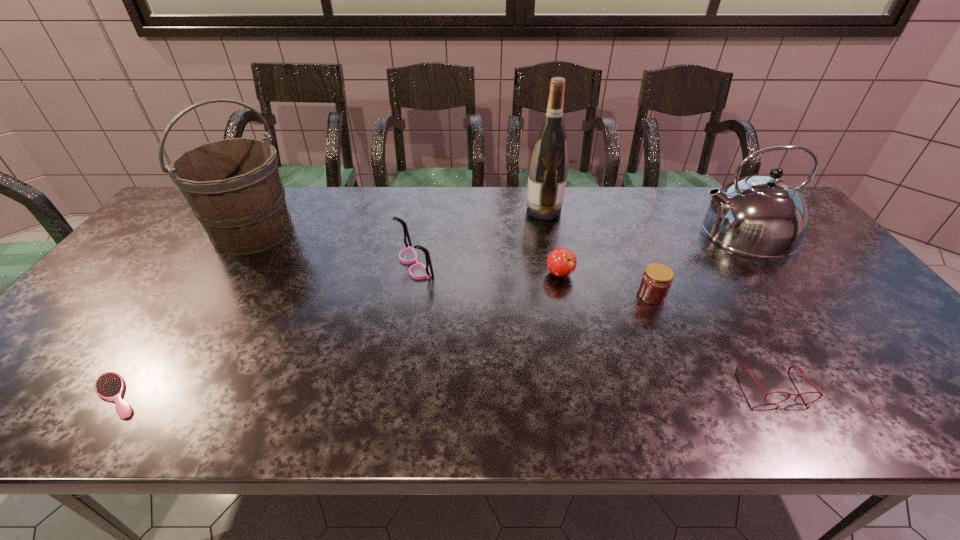
The width and height of the screenshot is (960, 540). In order to click on wine bottle in this screenshot , I will do `click(548, 167)`.

I want to click on bucket, so click(233, 186).

The image size is (960, 540). What are the coordinates of `the third tallest object` in the screenshot? It's located at (763, 216).

This screenshot has height=540, width=960. I want to click on the taller spectacles, so click(407, 256).

Locate an element on the screen. This screenshot has height=540, width=960. the left spectacles is located at coordinates click(x=407, y=256).

This screenshot has height=540, width=960. In order to click on the sixth object from left to right in this screenshot , I will do `click(657, 279)`.

You are a GUI agent. You are given a task and a screenshot of the screen. Output one action in this format:
    pyautogui.click(x=<x>, y=<y>)
    Task: Click on the jam
    Image resolution: width=960 pixels, height=540 pixels.
    Given the screenshot: What is the action you would take?
    pyautogui.click(x=657, y=279)

This screenshot has height=540, width=960. I want to click on apple, so click(561, 262).

Find the location of a particular element. the shorter spectacles is located at coordinates (801, 371).

Find the location of a particular element. the nearer spectacles is located at coordinates (801, 371).